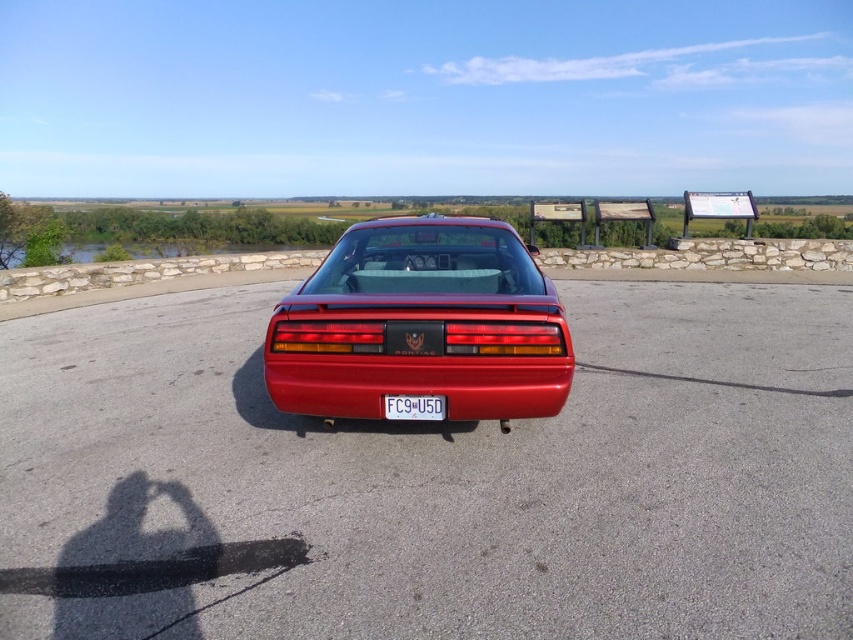
Question: Observing the image, what is the correct spatial positioning of glossy red car at center in reference to white plastic license plate at center?

Choices:
 (A) below
 (B) above

Answer: (B)

Question: Is glossy red car at center below glossy red bumper at center?

Choices:
 (A) no
 (B) yes

Answer: (A)

Question: Is glossy red car at center further to camera compared to glossy red bumper at center?

Choices:
 (A) no
 (B) yes

Answer: (A)

Question: Which of the following is the closest to the observer?

Choices:
 (A) (341, 362)
 (B) (392, 259)
 (C) (384, 401)

Answer: (A)

Question: Among these objects, which one is nearest to the camera?

Choices:
 (A) glossy red car at center
 (B) white plastic license plate at center

Answer: (A)

Question: Which point appears farthest from the camera in this image?

Choices:
 (A) (412, 404)
 (B) (389, 228)
 (C) (465, 362)

Answer: (B)